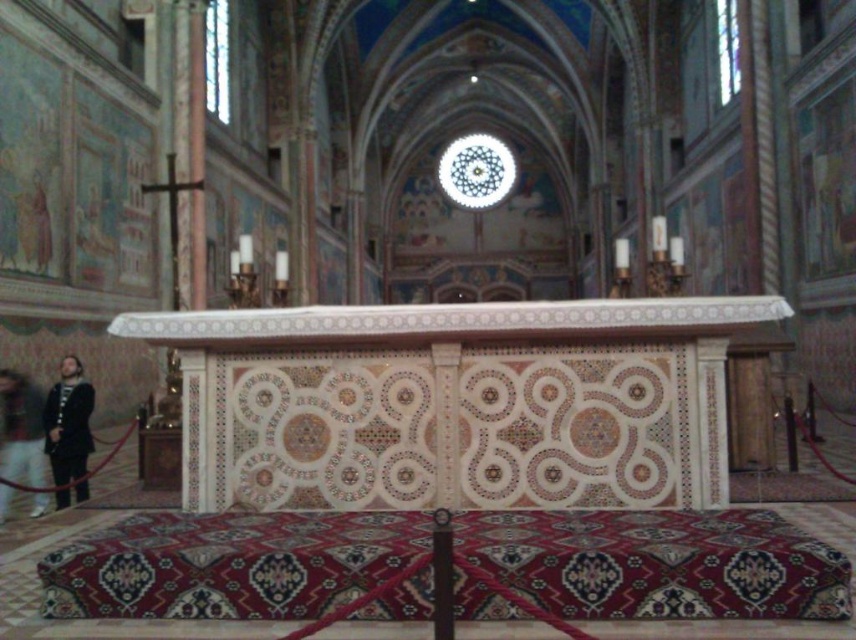
You are standing at the entrance of the church and see two points marked in the scene. The first point is at coordinate point (x=70, y=412) and the second is at point (x=6, y=493). Which point is closer to the altar?

Point (x=70, y=412) is behind point (x=6, y=493), so the second point is closer to the altar.